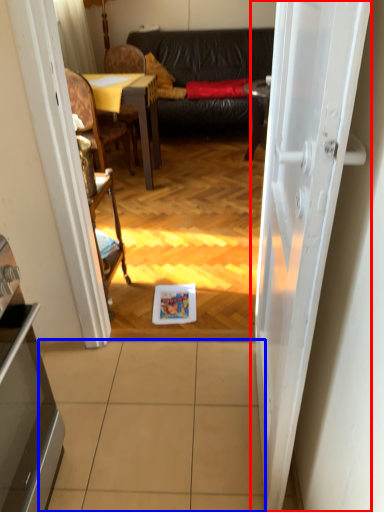
Question: Which of the following is the closest to the observer, door (highlighted by a red box) or tile (highlighted by a blue box)?

Choices:
 (A) door
 (B) tile

Answer: (A)